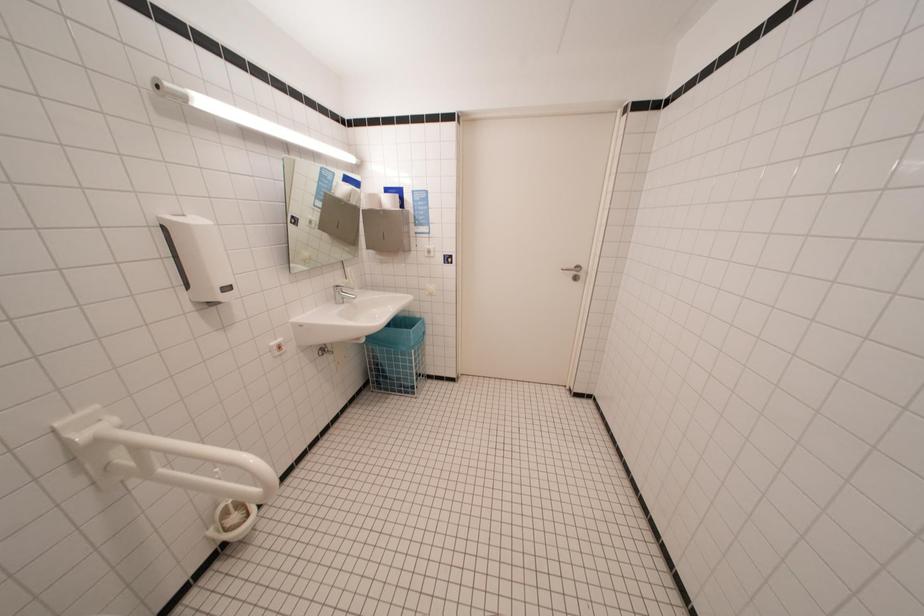
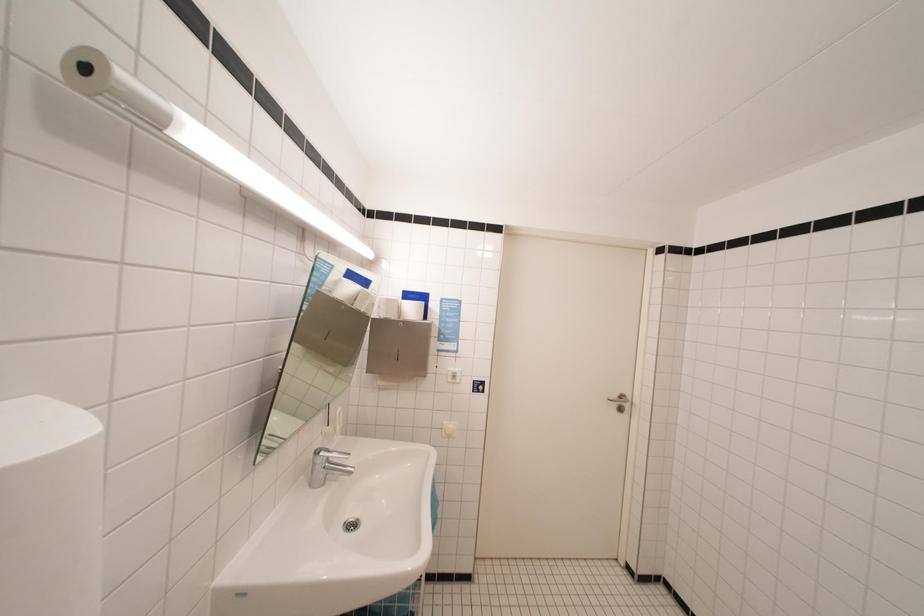
What movement of the cameraman would produce the second image?

The movement direction of the cameraman is left, forward.